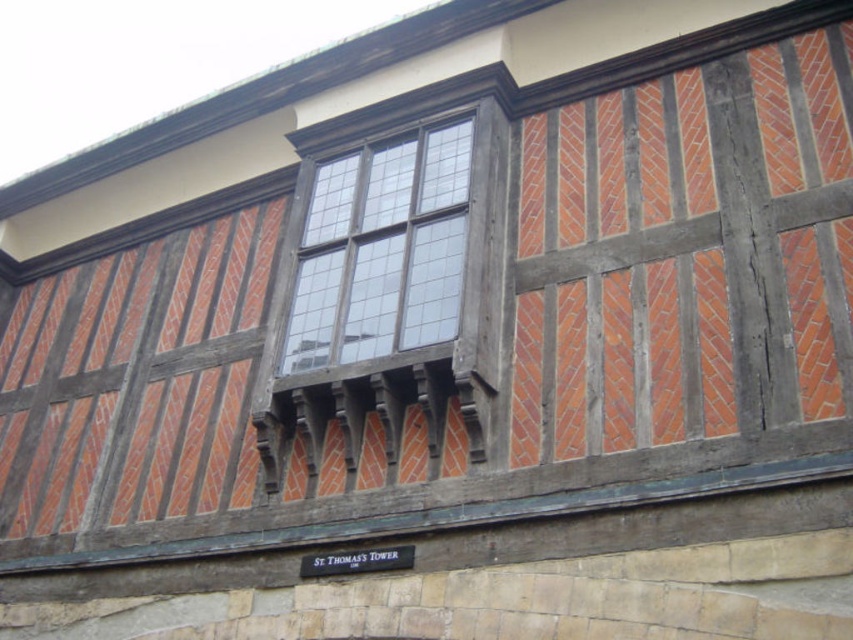
Who is lower down, dark brown wood at center or clear glass window at center?

dark brown wood at center is below.

Does dark brown wood at center have a lesser height compared to clear glass window at center?

Incorrect, dark brown wood at center's height does not fall short of clear glass window at center's.

Find the location of a particular element. This screenshot has height=640, width=853. dark brown wood at center is located at coordinates coord(392,275).